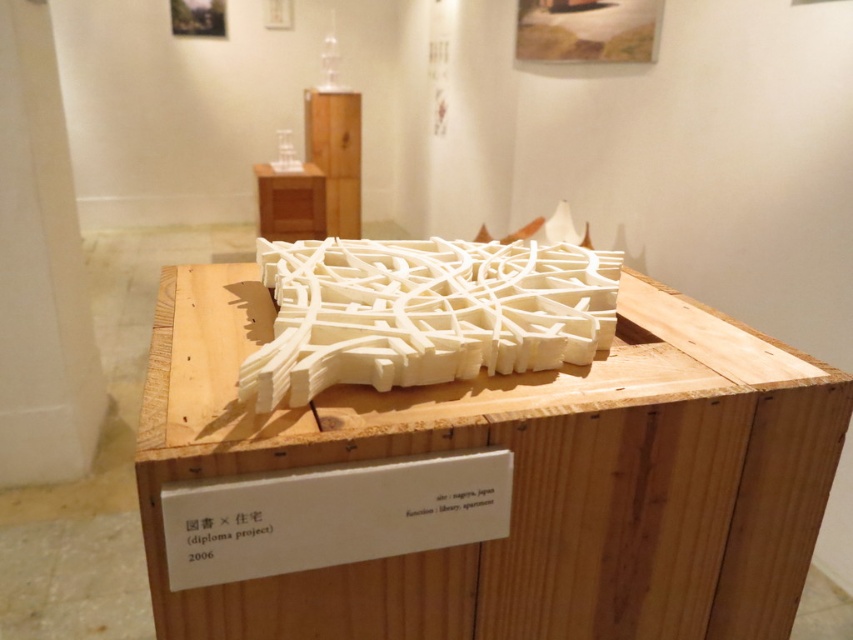
Who is positioned more to the right, white wood crate at center or white matte maze at center?

From the viewer's perspective, white wood crate at center appears more on the right side.

Between point (213, 316) and point (508, 275), which one is positioned in front?

Point (213, 316)

You are a GUI agent. You are given a task and a screenshot of the screen. Output one action in this format:
    pyautogui.click(x=<x>, y=<y>)
    Task: Click on the white wood crate at center
    
    Given the screenshot: What is the action you would take?
    pyautogui.click(x=485, y=484)